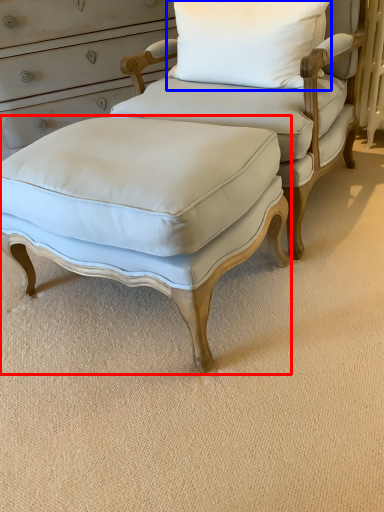
Question: Which of the following is the closest to the observer, stool (highlighted by a red box) or pillow (highlighted by a blue box)?

Choices:
 (A) stool
 (B) pillow

Answer: (A)